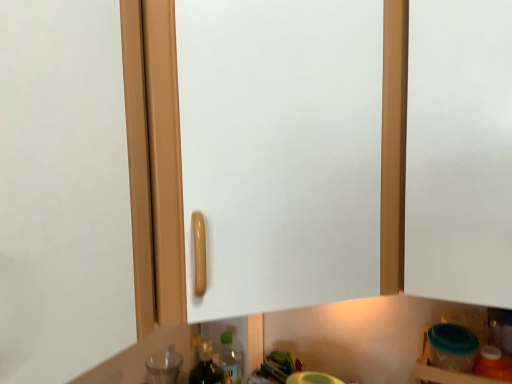
Question: Does point (488, 370) appear closer or farther from the camera than point (168, 362)?

Choices:
 (A) farther
 (B) closer

Answer: (B)

Question: From the image's perspective, relative to transparent glass bottle at lower left, which ranks as the 1th bottle in back-to-front order, is translucent orange bottle at lower right, the second bottle in the left-to-right sequence, above or below?

Choices:
 (A) above
 (B) below

Answer: (A)

Question: Based on their sizes in the image, would you say translucent orange bottle at lower right, the 1th bottle positioned from the right, is bigger or smaller than transparent glass bottle at lower left, marked as the second bottle in a front-to-back arrangement?

Choices:
 (A) small
 (B) big

Answer: (A)

Question: From a real-world perspective, is transparent glass bottle at lower left, marked as the second bottle in a front-to-back arrangement, physically located above or below translucent orange bottle at lower right, the second bottle in the left-to-right sequence?

Choices:
 (A) above
 (B) below

Answer: (B)

Question: Considering their positions, is transparent glass bottle at lower left, the first bottle viewed from the left, located in front of or behind translucent orange bottle at lower right, the 1th bottle positioned from the right?

Choices:
 (A) front
 (B) behind

Answer: (B)

Question: Do you think transparent glass bottle at lower left, the first bottle viewed from the left, is within translucent orange bottle at lower right, the second bottle in the left-to-right sequence, or outside of it?

Choices:
 (A) outside
 (B) inside

Answer: (A)

Question: Looking at the image, does transparent glass bottle at lower left, which ranks as the 1th bottle in back-to-front order, seem bigger or smaller compared to translucent orange bottle at lower right, the 1th bottle positioned from the right?

Choices:
 (A) big
 (B) small

Answer: (A)